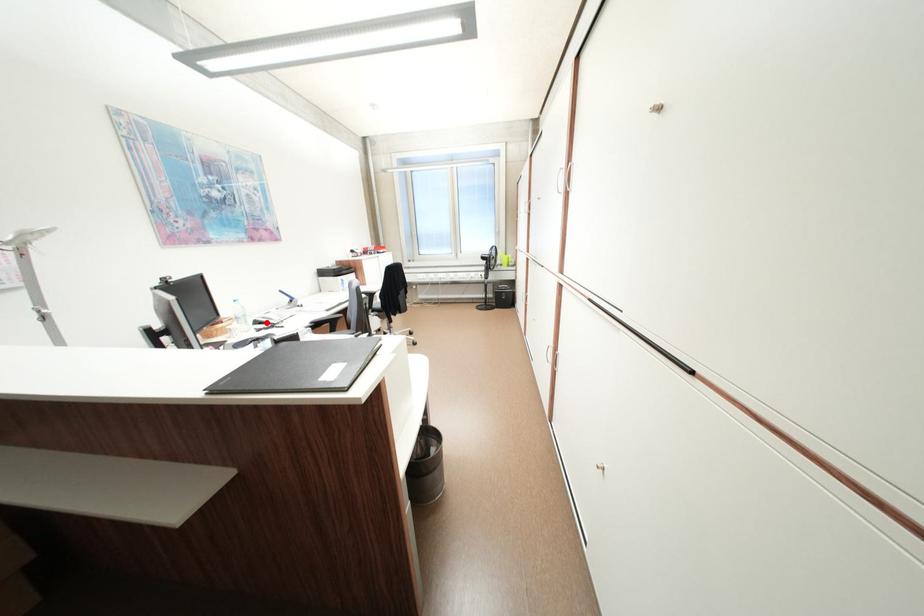
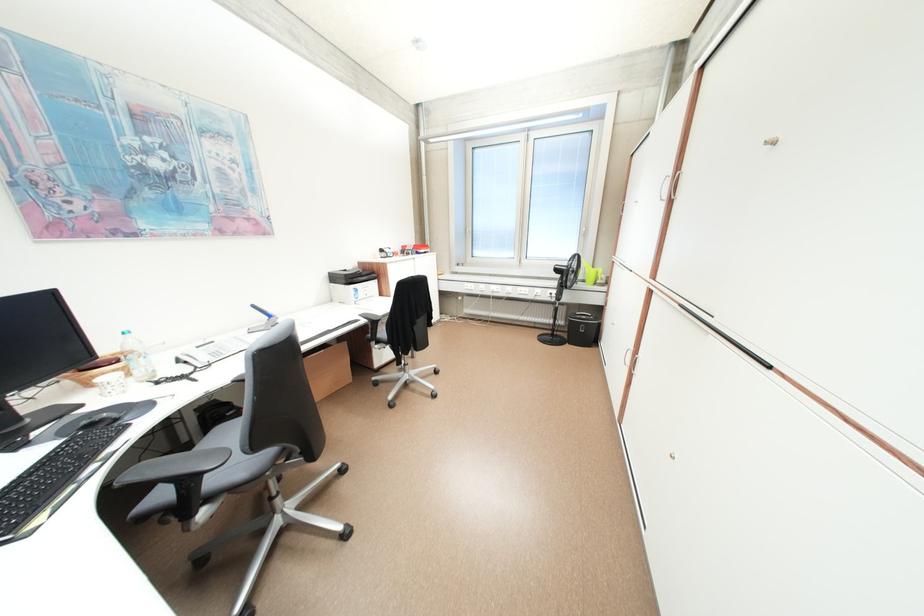
Question: I am providing you with two images of the same scene from different viewpoints. A red point is shown in image1. For the corresponding object point in image2, is it positioned nearer or farther from the camera?

Choices:
 (A) Nearer
 (B) Farther

Answer: (A)